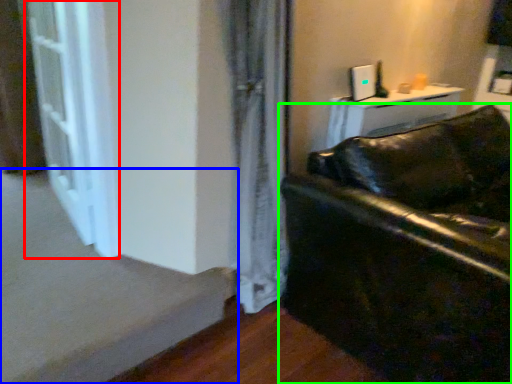
Question: Based on their relative distances, which object is nearer to screen door (highlighted by a red box)? Choose from stairwell (highlighted by a blue box) and studio couch (highlighted by a green box).

Choices:
 (A) stairwell
 (B) studio couch

Answer: (A)